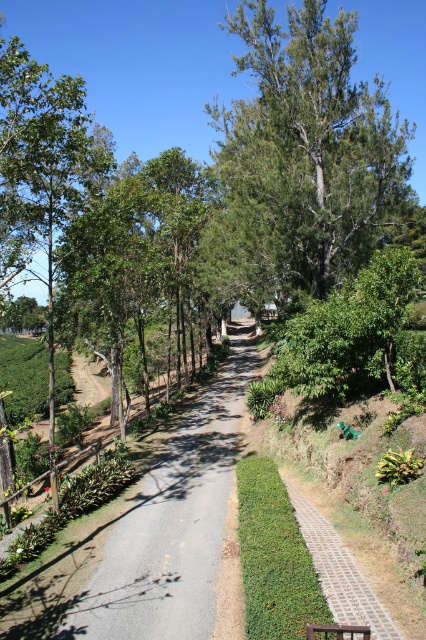
You are a hiker walking along the gray gravel trail at center in the rural scene. You want to sit down on the brown wooden bench at center. Can you reach it directly from your current position without leaving the trail?

The brown wooden bench at center is behind the gray gravel trail at center, so yes, you can reach it directly from your current position by walking along the trail towards the bench.

You are a hiker walking along the paved stone trail at center and the brown wooden bench at center. Which object is positioned to the right when facing the direction of the trail?

The paved stone trail at center is to the right of the brown wooden bench at center, so when facing the direction of the trail, the paved stone trail at center is positioned to the right of the brown wooden bench at center.

You are standing on the paved road in the rural scene and want to walk from point (158, 566) to point (310, 627). Which direction should you face to move towards the point that is closer to you?

You should face away from the viewer because point (158, 566) is closer to you than point (310, 627).